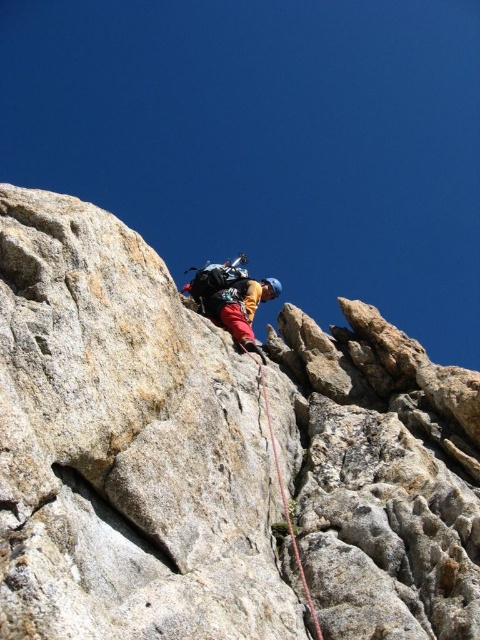
Is gray rock cliff at center taller than red nylon rope at center?

Correct, gray rock cliff at center is much taller as red nylon rope at center.

Describe the element at coordinates (128, 445) in the screenshot. I see `gray rock cliff at center` at that location.

At what (x,y) coordinates should I click in order to perform the action: click on gray rock cliff at center. Please return your answer as a coordinate pair (x, y). The height and width of the screenshot is (640, 480). Looking at the image, I should click on (128, 445).